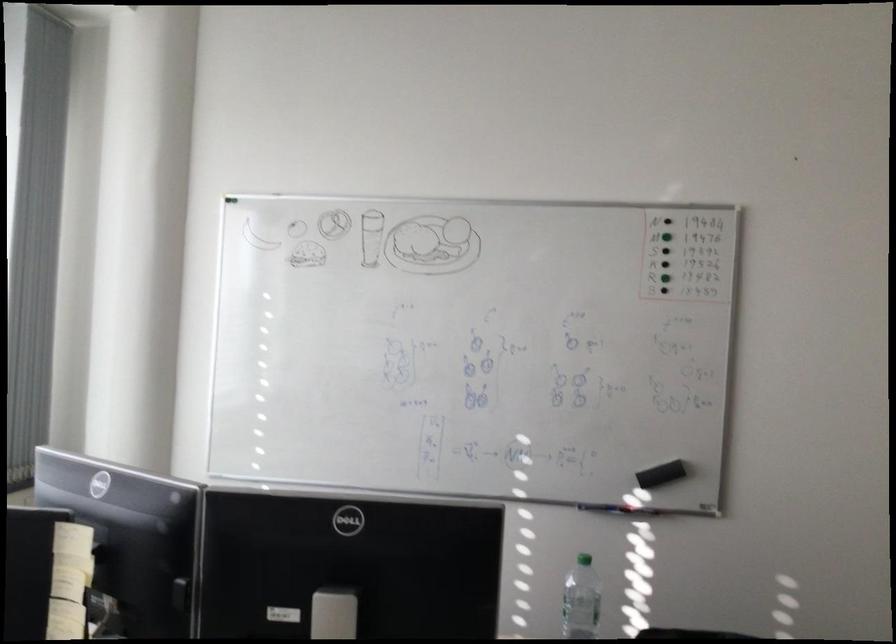
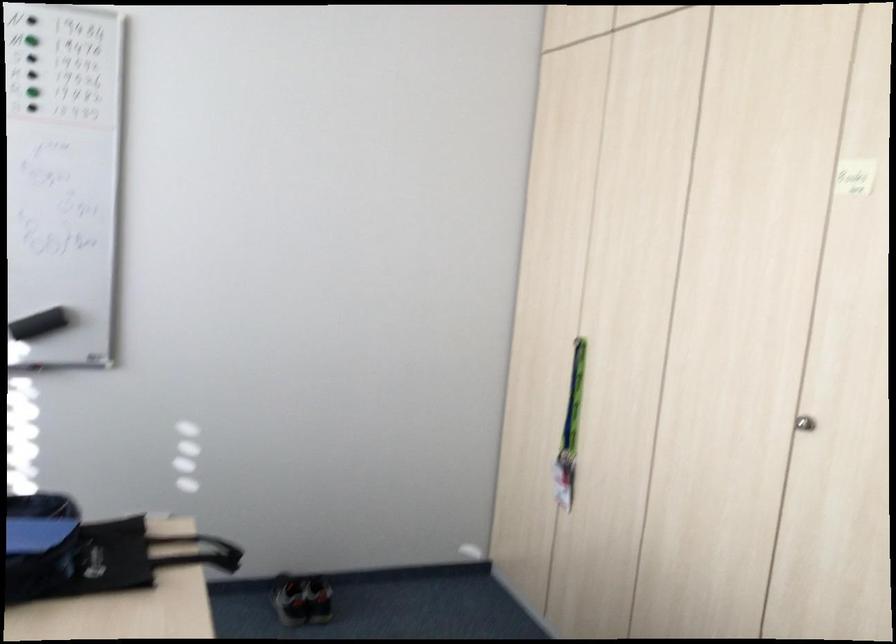
Where in the second image is the point corresponding to [668,469] from the first image?

(39, 324)